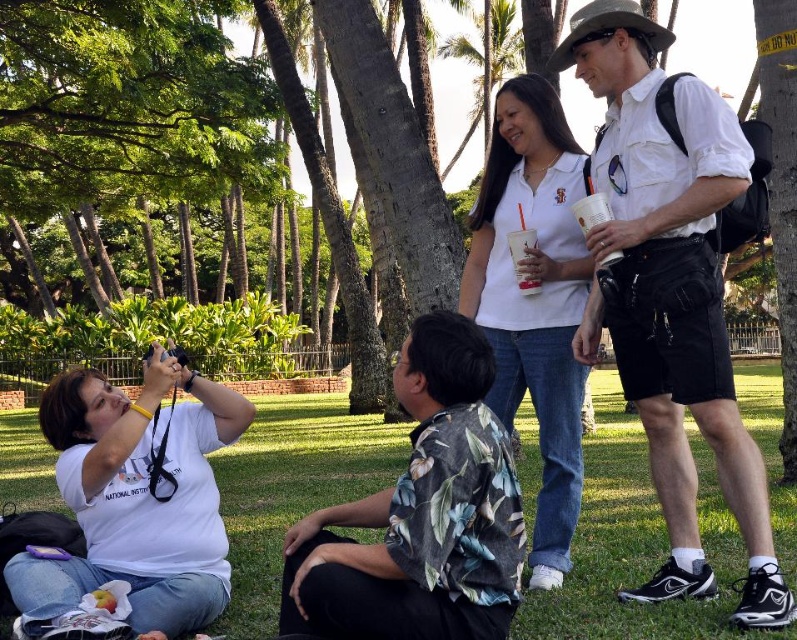
You are a photographer trying to capture a group photo of everyone in the scene. The camera you are using has a maximum focus range of 3 meters. Can you include the white cotton shirt at upper right in your photo without moving closer?

The distance between the white cotton shirt at upper right and the camera is 3.10 meters, which exceeds the camera maximum focus range of 3 meters. Therefore, you cannot include the white cotton shirt at upper right in the photo without moving closer.